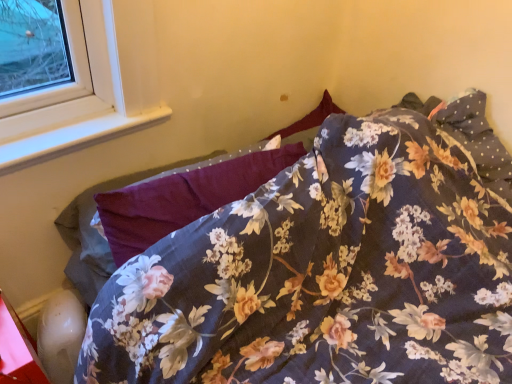
Question: Is floral fabric pillow at center positioned with its back to floral fabric bed at center?

Choices:
 (A) yes
 (B) no

Answer: (B)

Question: From the image's perspective, does floral fabric pillow at center appear higher than floral fabric bed at center?

Choices:
 (A) yes
 (B) no

Answer: (A)

Question: Is floral fabric pillow at center located outside floral fabric bed at center?

Choices:
 (A) yes
 (B) no

Answer: (B)

Question: Considering the relative sizes of floral fabric pillow at center and floral fabric bed at center in the image provided, is floral fabric pillow at center shorter than floral fabric bed at center?

Choices:
 (A) yes
 (B) no

Answer: (A)

Question: Considering the relative sizes of floral fabric pillow at center and floral fabric bed at center in the image provided, is floral fabric pillow at center taller than floral fabric bed at center?

Choices:
 (A) no
 (B) yes

Answer: (A)

Question: Considering the relative positions of white plastic window sill at upper left and floral fabric bed at center in the image provided, is white plastic window sill at upper left to the left or to the right of floral fabric bed at center?

Choices:
 (A) right
 (B) left

Answer: (B)

Question: Relative to floral fabric bed at center, is white plastic window sill at upper left in front or behind?

Choices:
 (A) front
 (B) behind

Answer: (B)

Question: Is point (104, 117) closer or farther from the camera than point (175, 241)?

Choices:
 (A) farther
 (B) closer

Answer: (A)

Question: Considering the positions of white plastic window sill at upper left and floral fabric bed at center in the image, is white plastic window sill at upper left bigger or smaller than floral fabric bed at center?

Choices:
 (A) big
 (B) small

Answer: (B)

Question: In terms of size, does floral fabric bed at center appear bigger or smaller than white plastic window sill at upper left?

Choices:
 (A) small
 (B) big

Answer: (B)

Question: From the image's perspective, is floral fabric bed at center located above or below white plastic window sill at upper left?

Choices:
 (A) above
 (B) below

Answer: (B)

Question: From a real-world perspective, relative to white plastic window sill at upper left, is floral fabric bed at center vertically above or below?

Choices:
 (A) below
 (B) above

Answer: (A)

Question: Visually, is floral fabric bed at center positioned to the left or to the right of white plastic window sill at upper left?

Choices:
 (A) left
 (B) right

Answer: (B)

Question: In terms of height, does floral fabric pillow at center look taller or shorter compared to floral fabric bed at center?

Choices:
 (A) short
 (B) tall

Answer: (A)

Question: Would you say floral fabric pillow at center is inside or outside floral fabric bed at center?

Choices:
 (A) outside
 (B) inside

Answer: (B)